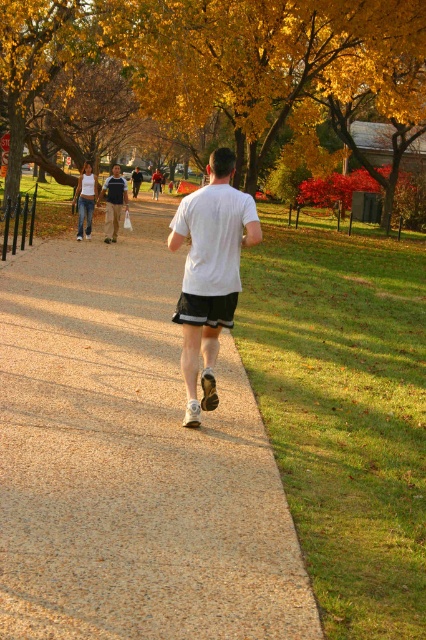
You are standing at the starting point of the path in the park. You see two points marked on the path ahead of you. The first point is at coordinates point (209, 204) and the second point is at point (92, 193). Which point will you encounter first as you walk along the path?

Point (209, 204) is in front of point (92, 193), so you will encounter point (209, 204) first as you walk along the path.

You are a photographer trying to capture a clear shot of the two people in white at the center of the image. Since both the white matte shirt at center and the white cotton tank top at center are similar in color, what visual cue might help you distinguish between them?

The white matte shirt at center has a lesser width compared to the white cotton tank top at center, so the narrower one is the white matte shirt at center.

You are standing at the start of the path in the park and see the yellow leafy tree at upper center and the white matte shirt at center. Which object is higher in the image?

The yellow leafy tree at upper center is positioned over the white matte shirt at center, so it is higher in the image.